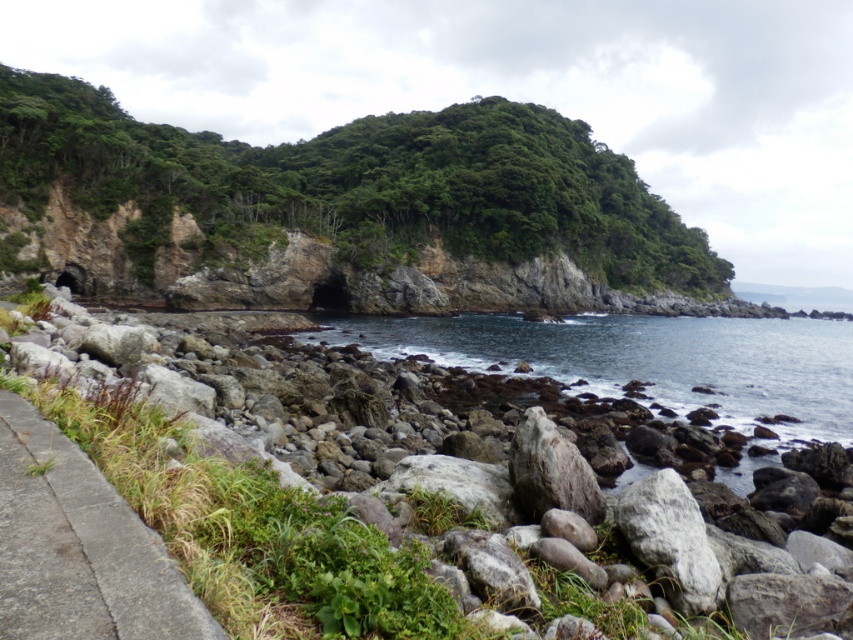
Can you confirm if rocky cliff at center is taller than dark blue water at center?

Correct, rocky cliff at center is much taller as dark blue water at center.

Between rocky cliff at center and dark blue water at center, which one has less height?

Standing shorter between the two is dark blue water at center.

Does point (225, 218) come closer to viewer compared to point (570, 374)?

No, it is not.

This screenshot has width=853, height=640. Identify the location of rocky cliff at center. (358, 184).

Is dark blue water at center wider than gray concrete path at lower left?

Indeed, dark blue water at center has a greater width compared to gray concrete path at lower left.

Does dark blue water at center appear on the left side of gray concrete path at lower left?

In fact, dark blue water at center is to the right of gray concrete path at lower left.

Between point (799, 384) and point (24, 461), which one is positioned in front?

Positioned in front is point (24, 461).

The height and width of the screenshot is (640, 853). I want to click on dark blue water at center, so click(645, 358).

In the scene shown: Does gray rock at center appear on the left side of dark blue water at center?

Indeed, gray rock at center is positioned on the left side of dark blue water at center.

Looking at this image, who is more forward, [323,396] or [770,344]?

Point [323,396] is in front.

Find the location of a particular element. The width and height of the screenshot is (853, 640). gray rock at center is located at coordinates (416, 492).